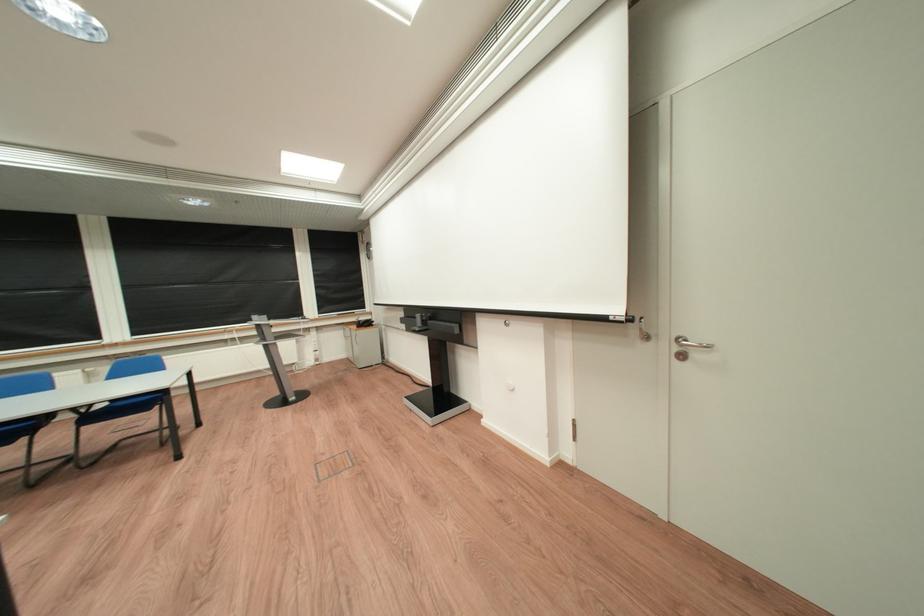
Image resolution: width=924 pixels, height=616 pixels. What do you see at coordinates (689, 342) in the screenshot? I see `the projector screen handle` at bounding box center [689, 342].